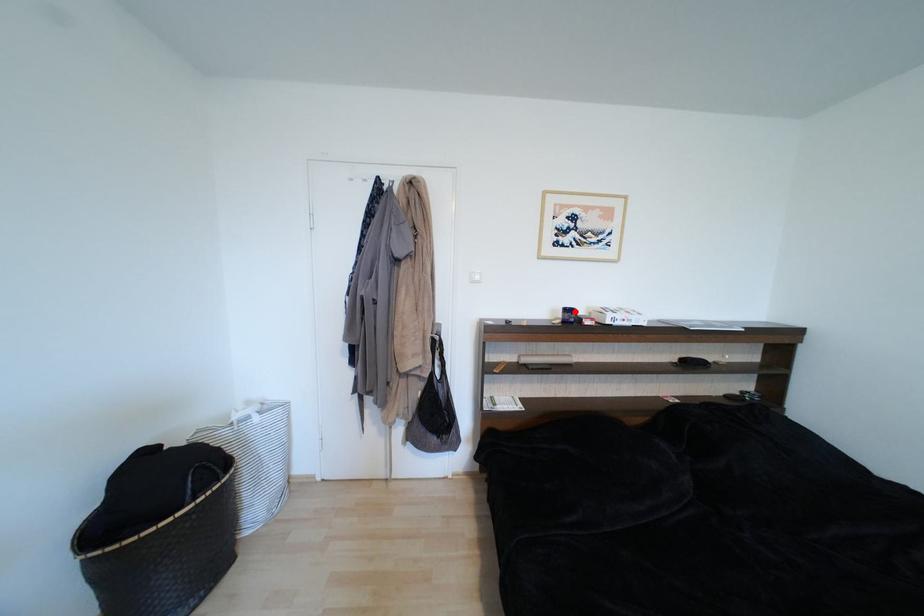
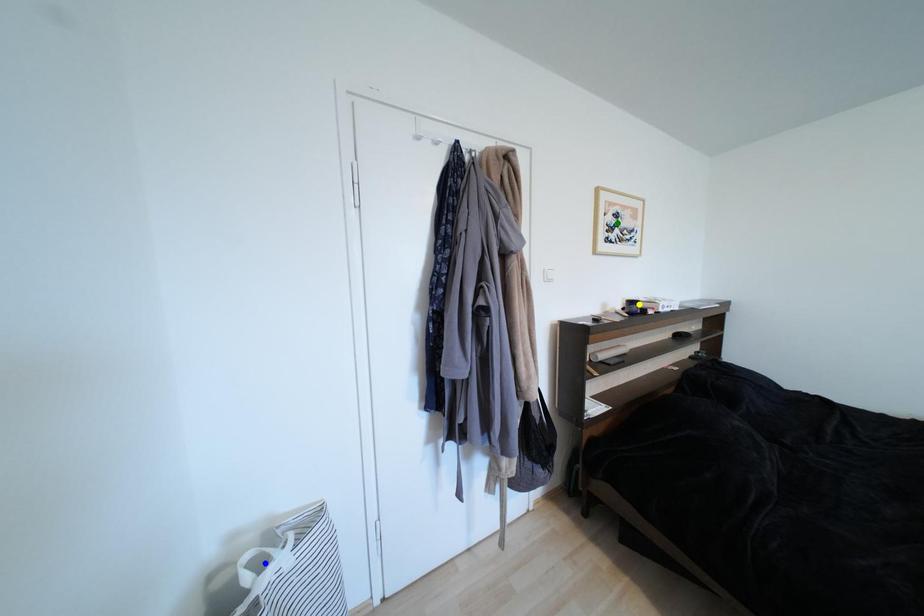
Question: I am providing you with two images of the same scene from different viewpoints. A red point is marked on the first image. You are given multiple points on the second image. Which point in image 2 represents the same 3d spot as the red point in image 1?

Choices:
 (A) blue point
 (B) green point
 (C) yellow point

Answer: (C)